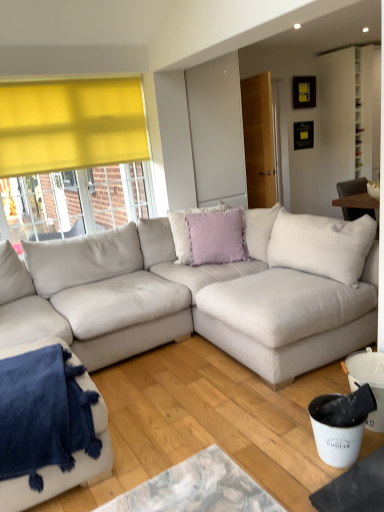
Question: Is lavender velvet cushion at center, the first pillow in the front-to-back sequence, at the right side of velvety blue blanket at lower left, which ranks as the 1th studio couch in left-to-right order?

Choices:
 (A) no
 (B) yes

Answer: (B)

Question: Considering the relative sizes of lavender velvet cushion at center, the second pillow positioned from the back, and velvety blue blanket at lower left, which is the 2th studio couch in right-to-left order, in the image provided, is lavender velvet cushion at center, the second pillow positioned from the back, taller than velvety blue blanket at lower left, which is the 2th studio couch in right-to-left order,?

Choices:
 (A) yes
 (B) no

Answer: (A)

Question: Does lavender velvet cushion at center, the second pillow positioned from the back, have a larger size compared to velvety blue blanket at lower left, which is the 2th studio couch in right-to-left order?

Choices:
 (A) no
 (B) yes

Answer: (A)

Question: From the image's perspective, is lavender velvet cushion at center, the second pillow positioned from the back, on top of velvety blue blanket at lower left, which ranks as the 1th studio couch in left-to-right order?

Choices:
 (A) yes
 (B) no

Answer: (A)

Question: Can you confirm if lavender velvet cushion at center, the second pillow positioned from the back, is shorter than velvety blue blanket at lower left, which is the 2th studio couch in right-to-left order?

Choices:
 (A) no
 (B) yes

Answer: (A)

Question: From the image's perspective, is lavender velvet cushion at center, the second pillow positioned from the back, above or below velvety blue blanket at lower left, which ranks as the 1th studio couch in left-to-right order?

Choices:
 (A) above
 (B) below

Answer: (A)

Question: Is lavender velvet cushion at center, the first pillow in the front-to-back sequence, situated inside velvety blue blanket at lower left, which ranks as the 1th studio couch in left-to-right order, or outside?

Choices:
 (A) outside
 (B) inside

Answer: (A)

Question: Considering the positions of point (233, 232) and point (105, 448), is point (233, 232) closer or farther from the camera than point (105, 448)?

Choices:
 (A) farther
 (B) closer

Answer: (A)

Question: From a real-world perspective, is lavender velvet cushion at center, the second pillow positioned from the back, physically located above or below velvety blue blanket at lower left, which is the 2th studio couch in right-to-left order?

Choices:
 (A) above
 (B) below

Answer: (A)

Question: Is point (107, 449) positioned closer to the camera than point (6, 310)?

Choices:
 (A) closer
 (B) farther

Answer: (A)

Question: Considering their positions, is velvety blue blanket at lower left, which ranks as the 1th studio couch in left-to-right order, located in front of or behind suede-like beige couch at center, acting as the first studio couch starting from the right?

Choices:
 (A) front
 (B) behind

Answer: (B)

Question: Is velvety blue blanket at lower left, which is the 2th studio couch in right-to-left order, inside the boundaries of suede-like beige couch at center, acting as the first studio couch starting from the right, or outside?

Choices:
 (A) inside
 (B) outside

Answer: (A)

Question: Looking at the image, does velvety blue blanket at lower left, which ranks as the 1th studio couch in left-to-right order, seem bigger or smaller compared to suede-like beige couch at center, the second studio couch from the left?

Choices:
 (A) small
 (B) big

Answer: (A)

Question: From a real-world perspective, is velvety blue blanket at lower left, which ranks as the 1th studio couch in left-to-right order, physically located above or below lavender velvet cushion at center, the first pillow in the front-to-back sequence?

Choices:
 (A) below
 (B) above

Answer: (A)

Question: Considering the positions of velvety blue blanket at lower left, which is the 2th studio couch in right-to-left order, and lavender velvet cushion at center, the first pillow in the front-to-back sequence, in the image, is velvety blue blanket at lower left, which is the 2th studio couch in right-to-left order, wider or thinner than lavender velvet cushion at center, the first pillow in the front-to-back sequence,?

Choices:
 (A) thin
 (B) wide

Answer: (B)